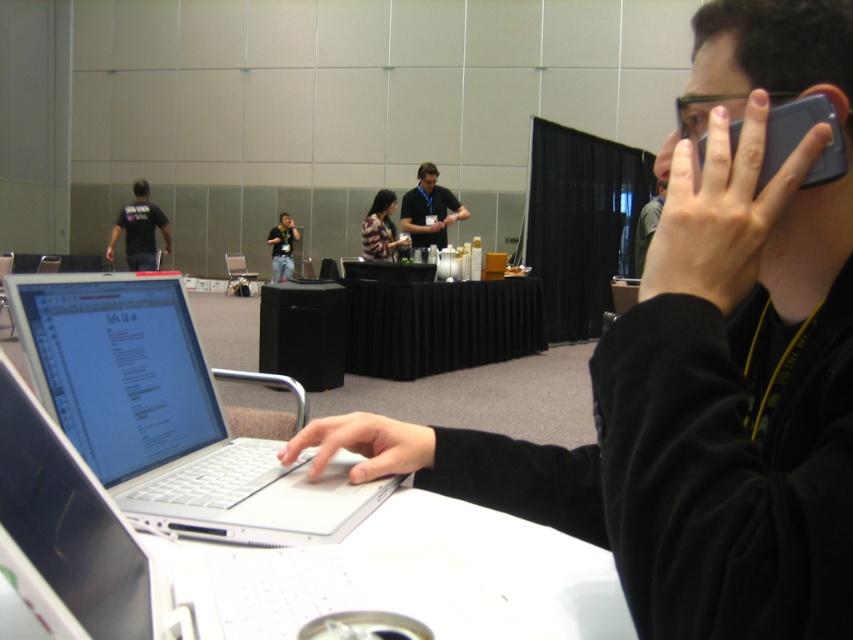
Please provide the coordinates of the white plastic laptop at center in the image. The coordinates should be in the format of a point with two decimal places, such as point (x=170, y=413).

The coordinates of the white plastic laptop at center are point (x=170, y=413).

You are a photographer trying to capture a candid shot of both the black fabric shirt at upper left and the striped fabric shirt at center. Based on their positions and sizes in the image, which one would appear larger in your photo?

The black fabric shirt at upper left would appear larger in the photo since it has a greater height compared to the striped fabric shirt at center as described.